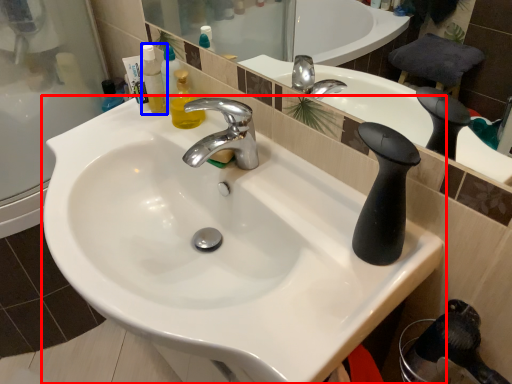
Question: Among these objects, which one is farthest to the camera, sink (highlighted by a red box) or mouthwash (highlighted by a blue box)?

Choices:
 (A) sink
 (B) mouthwash

Answer: (B)